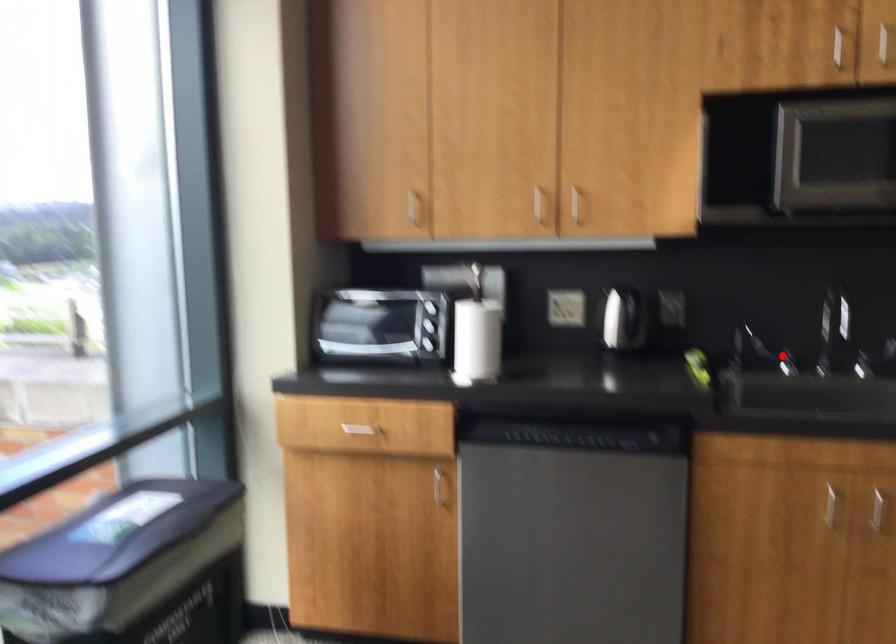
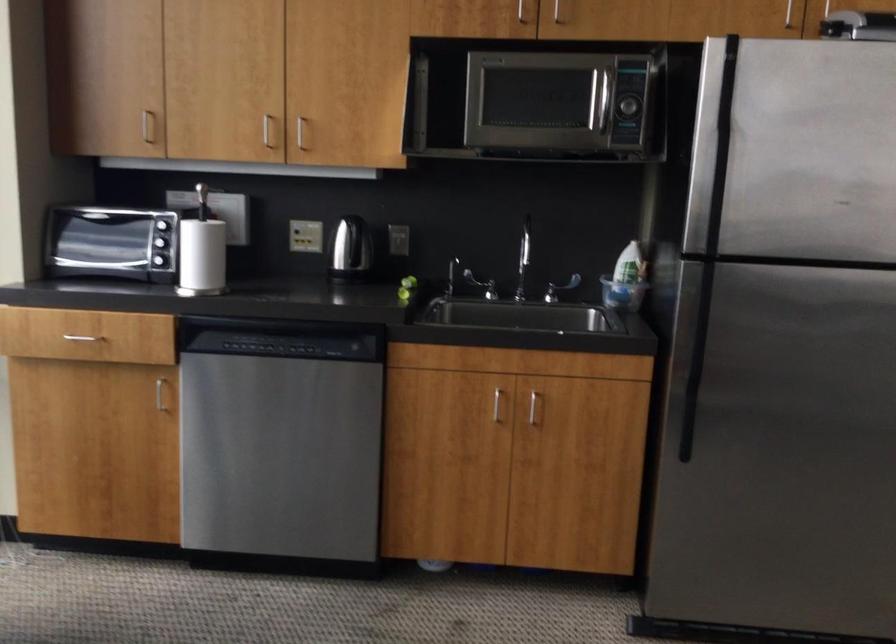
In the second image, find the point that corresponds to the highlighted location in the first image.

(480, 285)